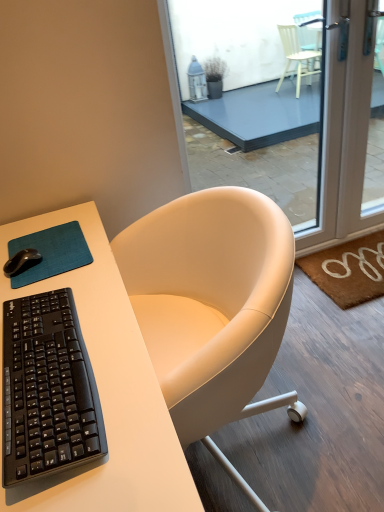
Question: Is white matte desk at center in front of or behind brown coir doormat at lower right in the image?

Choices:
 (A) front
 (B) behind

Answer: (A)

Question: From a real-world perspective, is white matte desk at center above or below brown coir doormat at lower right?

Choices:
 (A) above
 (B) below

Answer: (A)

Question: Which object is positioned closest to the black matte mouse at upper left?

Choices:
 (A) teal fabric mousepad at lower left
 (B) white matte desk at center
 (C) black plastic keyboard at left
 (D) white leather chair at center
 (E) transparent glass door at center

Answer: (A)

Question: Which object is positioned closest to the black matte mouse at upper left?

Choices:
 (A) brown coir doormat at lower right
 (B) white matte desk at center
 (C) transparent glass door at center
 (D) teal fabric mousepad at lower left
 (E) black plastic keyboard at left

Answer: (D)